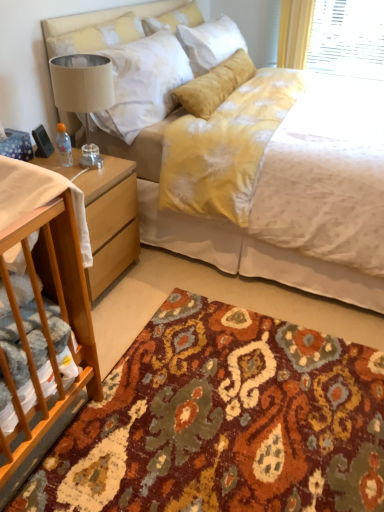
Question: From the image's perspective, is soft yellow pillow at upper center beneath beige fabric lampshade at left?

Choices:
 (A) no
 (B) yes

Answer: (A)

Question: Is soft yellow pillow at upper center at the right side of beige fabric lampshade at left?

Choices:
 (A) no
 (B) yes

Answer: (B)

Question: Is soft yellow pillow at upper center not close to beige fabric lampshade at left?

Choices:
 (A) yes
 (B) no

Answer: (B)

Question: Is soft yellow pillow at upper center positioned before beige fabric lampshade at left?

Choices:
 (A) no
 (B) yes

Answer: (A)

Question: Could you tell me if soft yellow pillow at upper center is turned towards beige fabric lampshade at left?

Choices:
 (A) yes
 (B) no

Answer: (B)

Question: Is point (195, 250) positioned closer to the camera than point (100, 287)?

Choices:
 (A) farther
 (B) closer

Answer: (A)

Question: In the image, is yellow fabric bed at center positioned in front of or behind light brown wood nightstand at lower left?

Choices:
 (A) behind
 (B) front

Answer: (B)

Question: In terms of width, does yellow fabric bed at center look wider or thinner when compared to light brown wood nightstand at lower left?

Choices:
 (A) wide
 (B) thin

Answer: (A)

Question: From a real-world perspective, is yellow fabric bed at center physically located above or below light brown wood nightstand at lower left?

Choices:
 (A) above
 (B) below

Answer: (A)

Question: Considering the positions of point pyautogui.click(x=175, y=240) and point pyautogui.click(x=236, y=476), is point pyautogui.click(x=175, y=240) closer or farther from the camera than point pyautogui.click(x=236, y=476)?

Choices:
 (A) farther
 (B) closer

Answer: (A)

Question: Considering their positions, is yellow fabric bed at center located in front of or behind multicolored woven rug at lower center?

Choices:
 (A) front
 (B) behind

Answer: (B)

Question: Based on their positions, is yellow fabric bed at center located to the left or right of multicolored woven rug at lower center?

Choices:
 (A) right
 (B) left

Answer: (A)

Question: From the image's perspective, is yellow fabric bed at center located above or below multicolored woven rug at lower center?

Choices:
 (A) above
 (B) below

Answer: (A)

Question: From a real-world perspective, is light brown wood nightstand at lower left above or below white fabric at left?

Choices:
 (A) below
 (B) above

Answer: (A)

Question: From their relative heights in the image, would you say light brown wood nightstand at lower left is taller or shorter than white fabric at left?

Choices:
 (A) short
 (B) tall

Answer: (B)